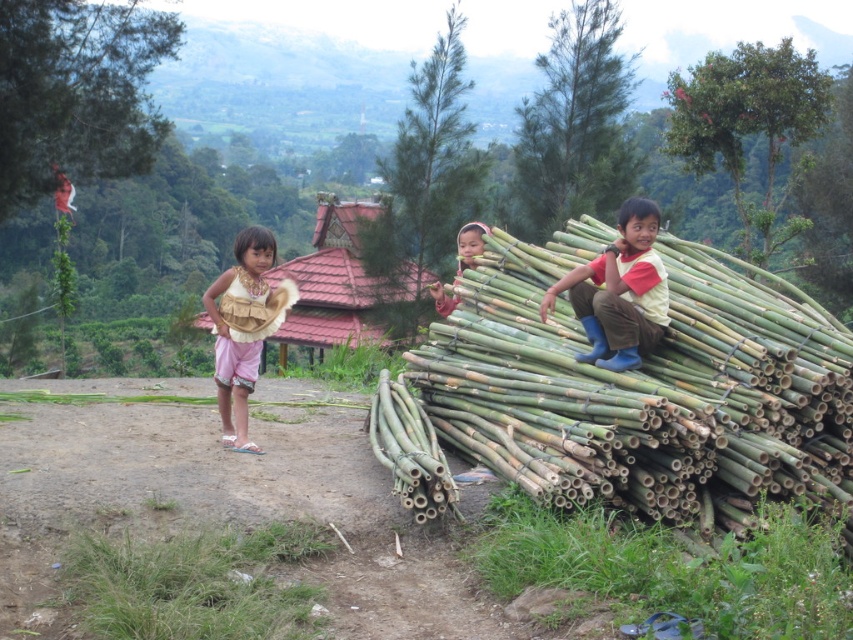
Question: Considering the real-world distances, which object is farthest from the pink satin dress at left?

Choices:
 (A) green bamboo logs at right
 (B) matte yellow shirt at right

Answer: (A)

Question: From the image, what is the correct spatial relationship of pink satin dress at left in relation to smooth bamboo stick at center?

Choices:
 (A) left
 (B) right

Answer: (A)

Question: Which is nearer to the pink satin dress at left?

Choices:
 (A) smooth bamboo stick at center
 (B) matte yellow shirt at right
 (C) green bamboo logs at right

Answer: (B)

Question: Which of the following is the farthest from the observer?

Choices:
 (A) matte yellow shirt at right
 (B) pink satin dress at left
 (C) smooth bamboo stick at center
 (D) green bamboo logs at right

Answer: (C)

Question: Does matte yellow shirt at right have a greater width compared to smooth bamboo stick at center?

Choices:
 (A) no
 (B) yes

Answer: (B)

Question: Does matte yellow shirt at right appear on the left side of smooth bamboo stick at center?

Choices:
 (A) yes
 (B) no

Answer: (B)